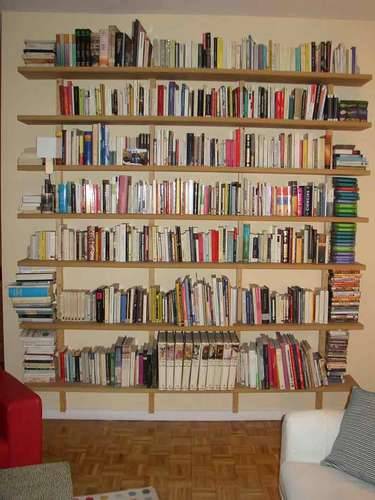
This screenshot has height=500, width=375. Find the location of `wall behind shelf`. wall behind shelf is located at coordinates (267, 275), (93, 277), (82, 335).